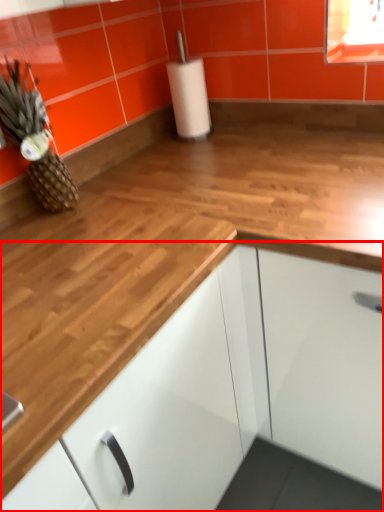
Question: Where is cabinetry (annotated by the red box) located in relation to pineapple in the image?

Choices:
 (A) right
 (B) left

Answer: (A)